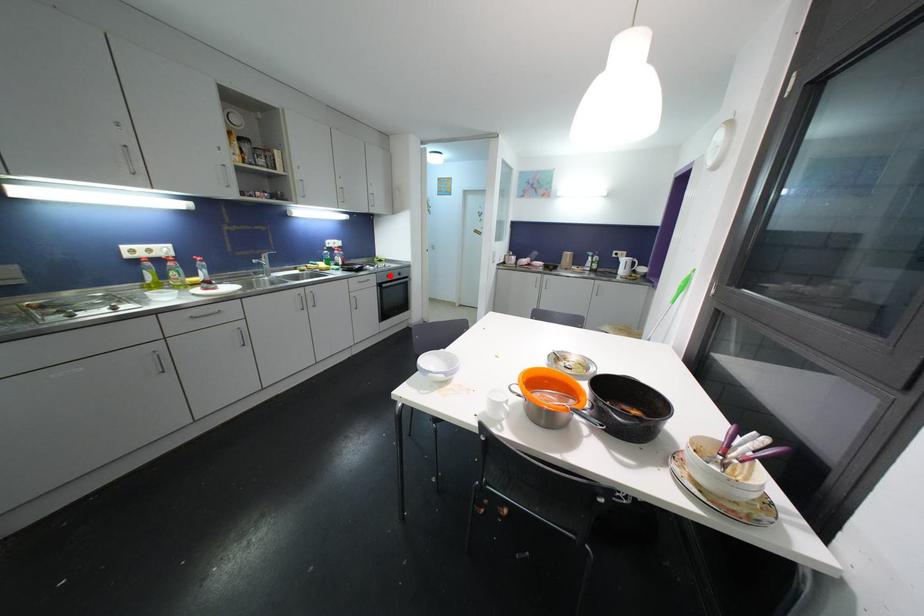
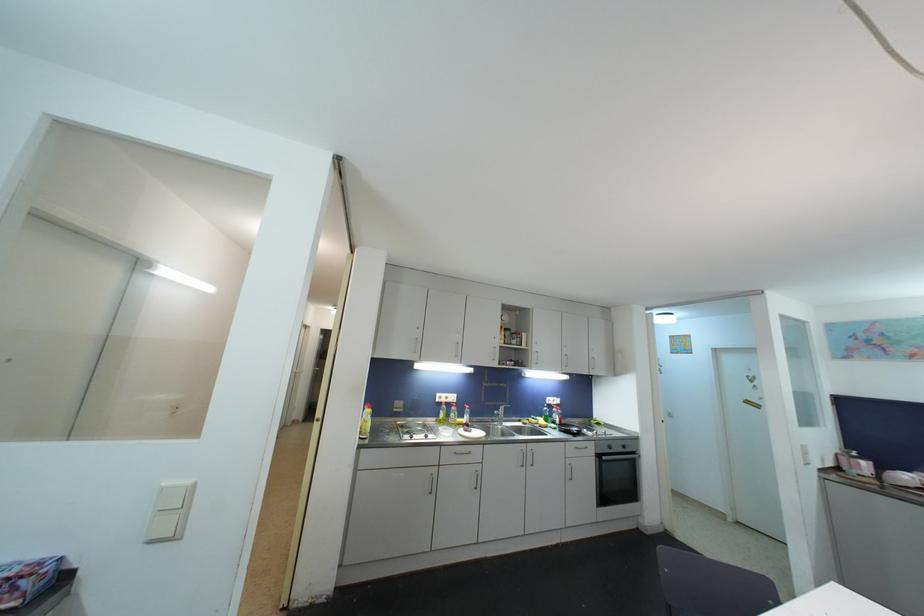
Find the pixel in the second image that matches the highlighted location in the first image.

(611, 446)